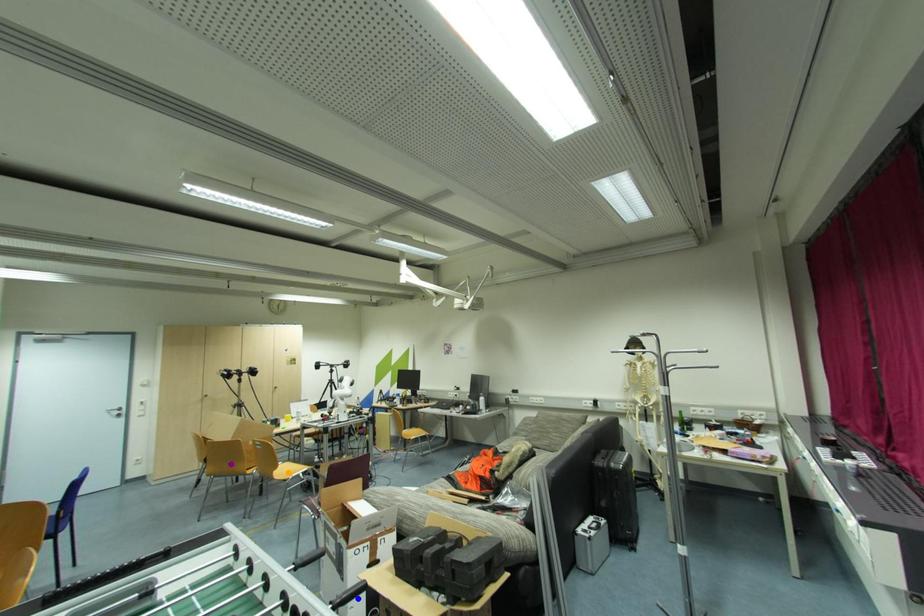
Order these from nearest to farthest:
A) purple point
B) orange point
C) blue point

1. orange point
2. purple point
3. blue point